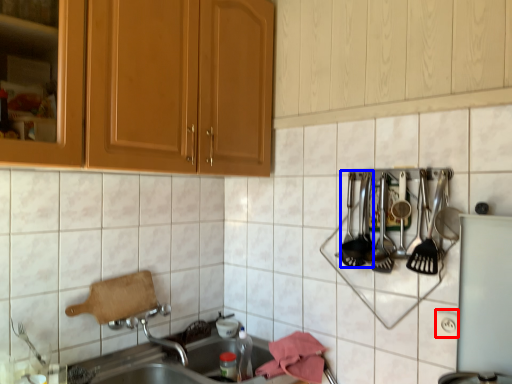
Question: Which point is closer to the camera, electric outlet (highlighted by a red box) or silverware (highlighted by a blue box)?

Choices:
 (A) electric outlet
 (B) silverware

Answer: (A)